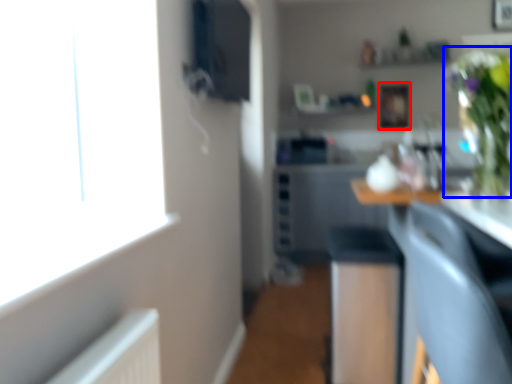
Question: Which object is closer to the camera taking this photo, picture frame (highlighted by a red box) or floral arrangement (highlighted by a blue box)?

Choices:
 (A) picture frame
 (B) floral arrangement

Answer: (B)